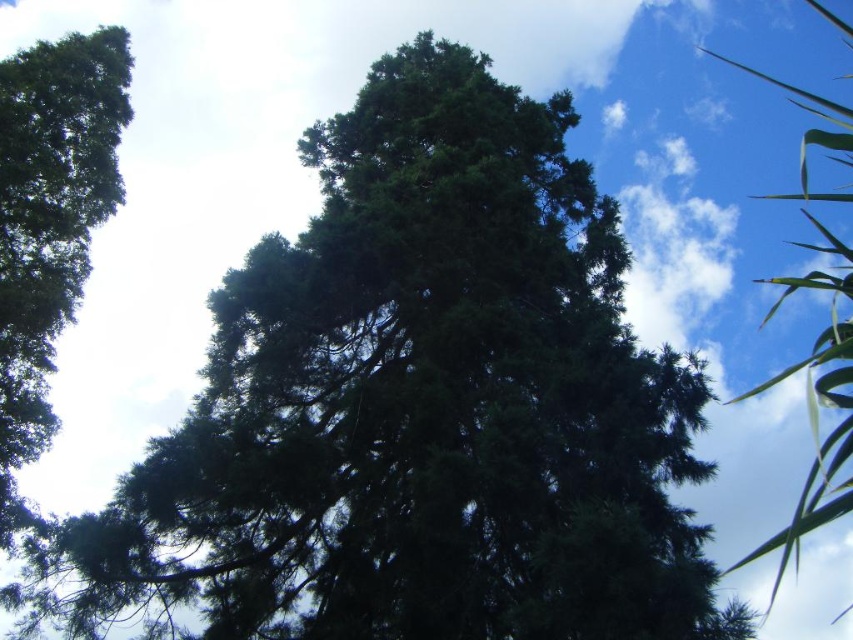
Question: Does green needle-like tree at left have a greater width compared to green leafy tree at upper right?

Choices:
 (A) no
 (B) yes

Answer: (A)

Question: Which point is farther to the camera?

Choices:
 (A) (80, 163)
 (B) (799, 90)

Answer: (B)

Question: Among these objects, which one is farthest from the camera?

Choices:
 (A) green needle-like tree at left
 (B) green leafy tree at upper right

Answer: (A)

Question: Can you confirm if green needle-like tree at left is positioned below green leafy tree at upper right?

Choices:
 (A) yes
 (B) no

Answer: (A)

Question: Does green needle-like tree at left have a lesser width compared to green leafy tree at upper right?

Choices:
 (A) yes
 (B) no

Answer: (A)